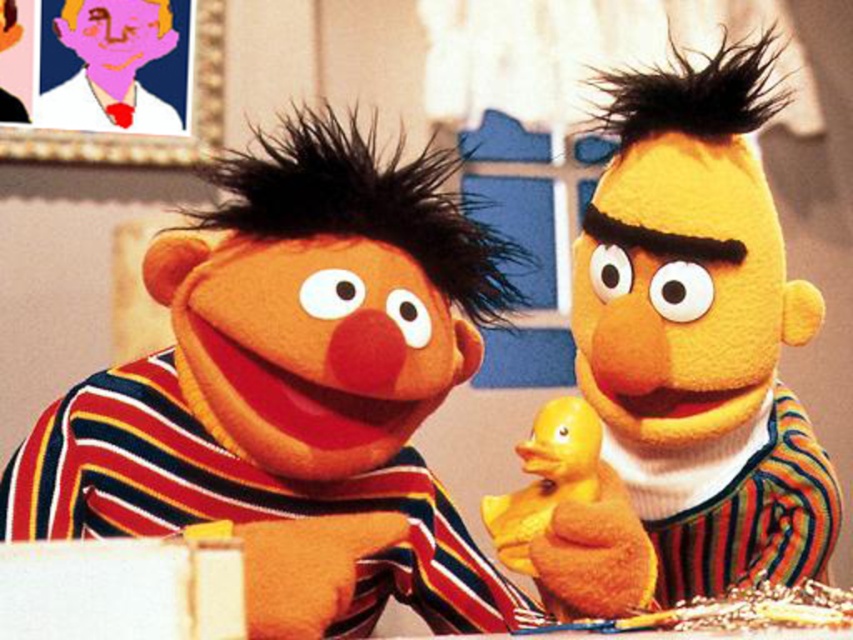
Is point (184, 412) positioned before point (596, 496)?

No.

Between matte cardboard box at left and rubber duck at center, which one is positioned lower?

rubber duck at center

Is point (172, 316) less distant than point (544, 422)?

Yes.

This screenshot has width=853, height=640. Find the location of `matte cardboard box at left`. matte cardboard box at left is located at coordinates (293, 374).

Is yellow plush duck at right thinner than rubber duck at center?

No.

Image resolution: width=853 pixels, height=640 pixels. What do you see at coordinates (688, 358) in the screenshot? I see `yellow plush duck at right` at bounding box center [688, 358].

Where is `yellow plush duck at right`? yellow plush duck at right is located at coordinates point(688,358).

Image resolution: width=853 pixels, height=640 pixels. What do you see at coordinates (293, 374) in the screenshot?
I see `matte cardboard box at left` at bounding box center [293, 374].

Does matte cardboard box at left have a greater height compared to yellow plush duck at right?

No, matte cardboard box at left is not taller than yellow plush duck at right.

Identify the location of matte cardboard box at left. (293, 374).